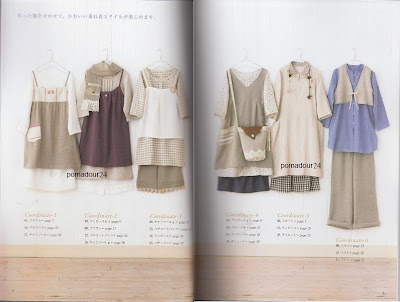
Find the location of `hooks of clothes hangers`. hooks of clothes hangers is located at coordinates (47, 50), (103, 49), (158, 50), (240, 49), (297, 50), (351, 49).